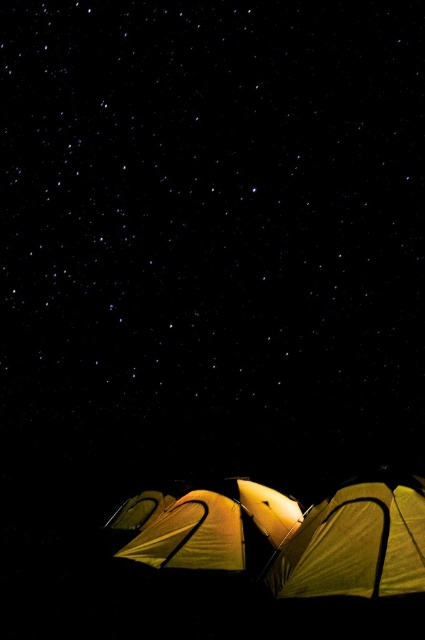
Question: Is yellow fabric tent at lower right to the left of matte yellow tent at lower center from the viewer's perspective?

Choices:
 (A) yes
 (B) no

Answer: (B)

Question: Can you confirm if yellow fabric tent at lower center is positioned to the right of yellow fabric tent at lower right?

Choices:
 (A) no
 (B) yes

Answer: (A)

Question: Which is nearer to the yellow fabric tent at lower center?

Choices:
 (A) matte yellow tent at lower center
 (B) yellow fabric tent at lower right

Answer: (A)

Question: Which object appears farthest from the camera in this image?

Choices:
 (A) yellow fabric tent at lower right
 (B) yellow fabric tent at lower center
 (C) matte yellow tent at lower center

Answer: (C)

Question: Does yellow fabric tent at lower center have a larger size compared to matte yellow tent at lower center?

Choices:
 (A) yes
 (B) no

Answer: (B)

Question: Which of the following is the closest to the observer?

Choices:
 (A) matte yellow tent at lower center
 (B) yellow fabric tent at lower right
 (C) yellow fabric tent at lower center

Answer: (B)